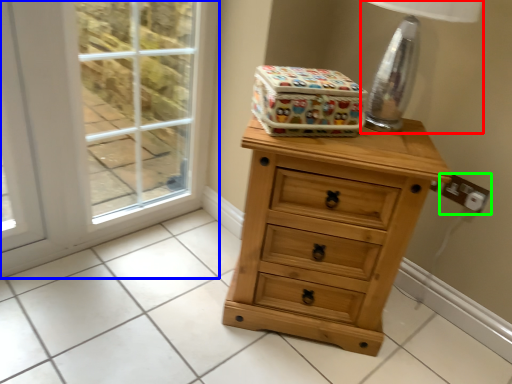
Question: Considering the real-world distances, which object is closest to table lamp (highlighted by a red box)? screen door (highlighted by a blue box) or electric outlet (highlighted by a green box).

Choices:
 (A) screen door
 (B) electric outlet

Answer: (B)